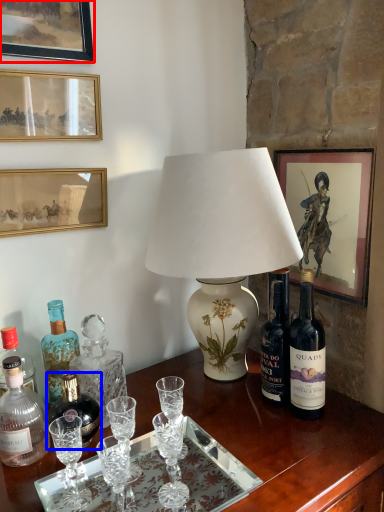
Question: Among these objects, which one is nearest to the camera, picture frame (highlighted by a red box) or bottle (highlighted by a blue box)?

Choices:
 (A) picture frame
 (B) bottle

Answer: (A)